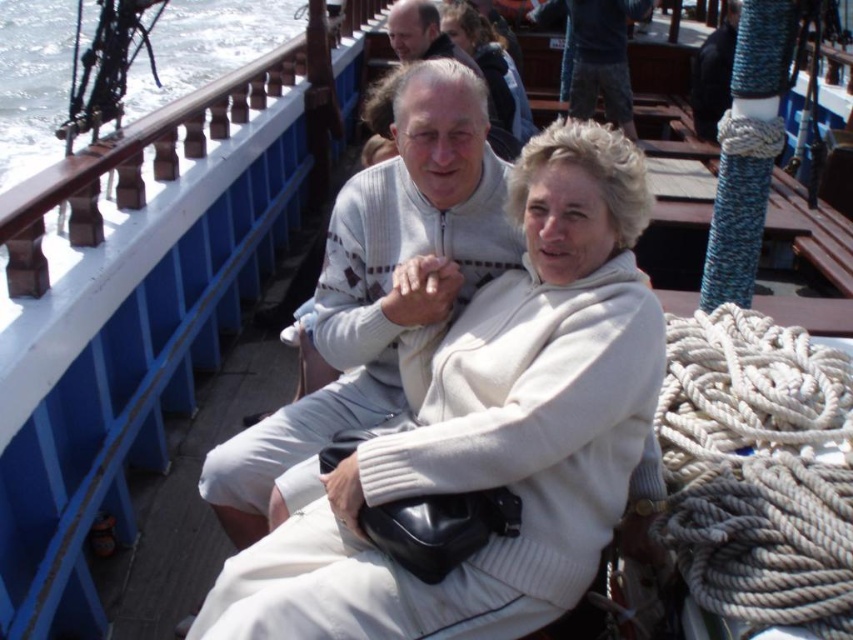
You are a photographer on the boat and want to capture a closeup of the two people. Since the white wool sweater at upper center and smooth brown hair at upper center are in the frame, which one will appear larger in the photo?

The white wool sweater at upper center will appear larger in the photo because it has a greater height compared to the smooth brown hair at upper center.

You are a photographer on the boat and want to take a picture of the light gray sweater at center and smooth brown hair at upper center. Which object should you adjust your camera to focus on first if you want to capture both in the same frame without moving the camera?

The light gray sweater at center is to the left of smooth brown hair at upper center, so you should focus on the smooth brown hair at upper center first as it is closer to the camera.